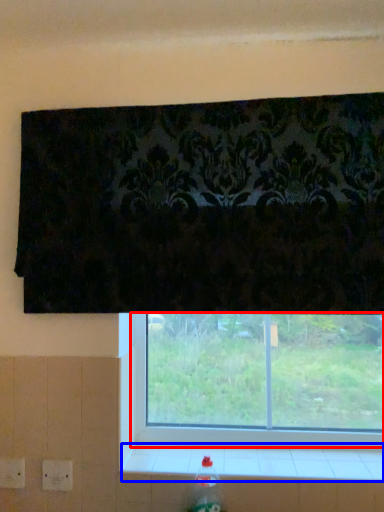
Question: Which of the following is the closest to the observer, window (highlighted by a red box) or window sill (highlighted by a blue box)?

Choices:
 (A) window
 (B) window sill

Answer: (B)